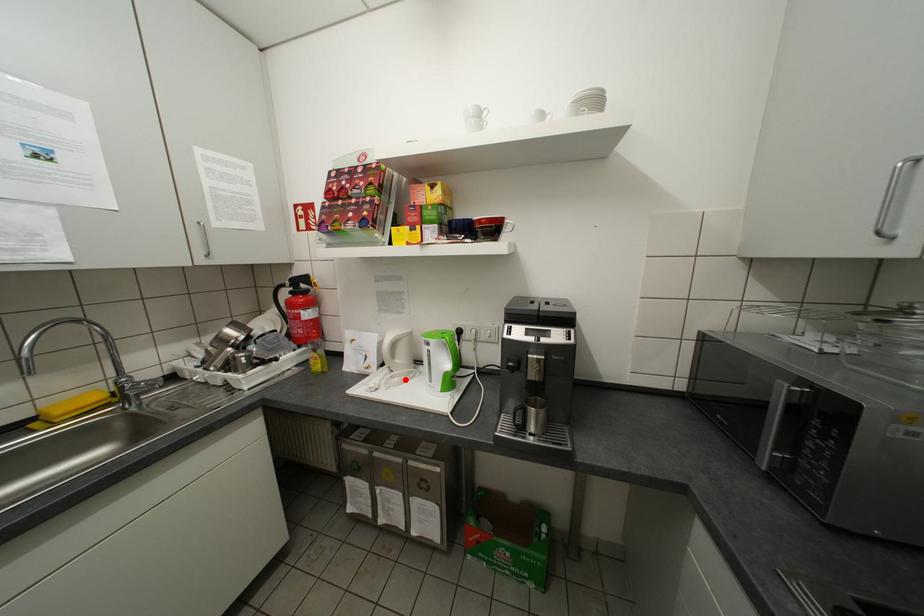
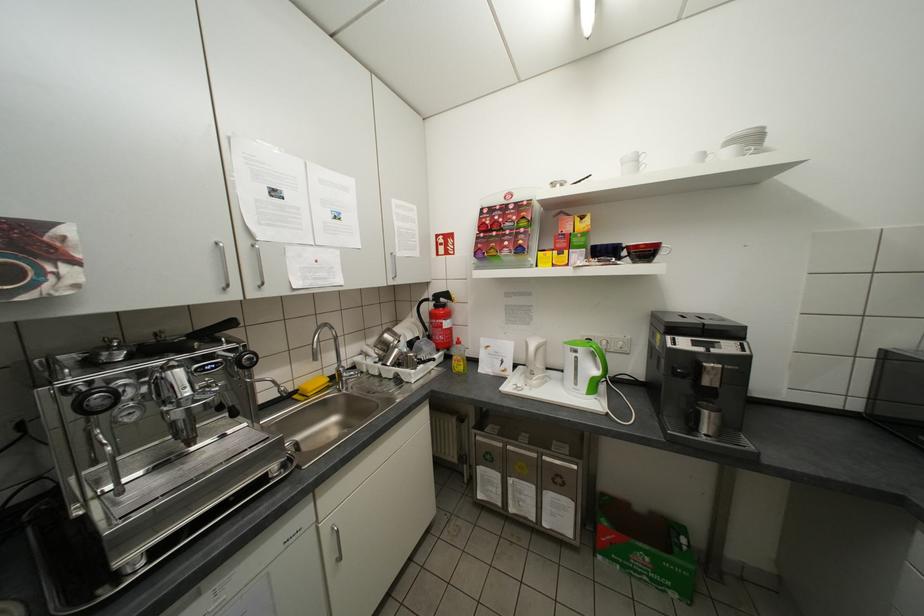
Locate, in the second image, the point that corresponds to the highlighted location in the first image.

(543, 382)